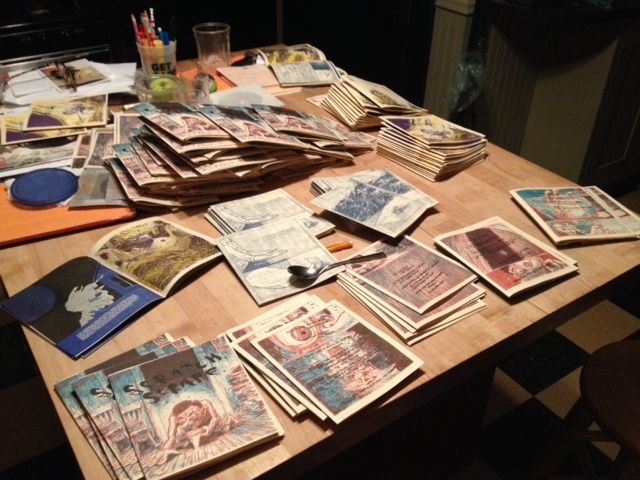
Where is `paper pamphlets`? This screenshot has width=640, height=480. paper pamphlets is located at coordinates (198, 379), (308, 352), (397, 300), (516, 250), (588, 208).